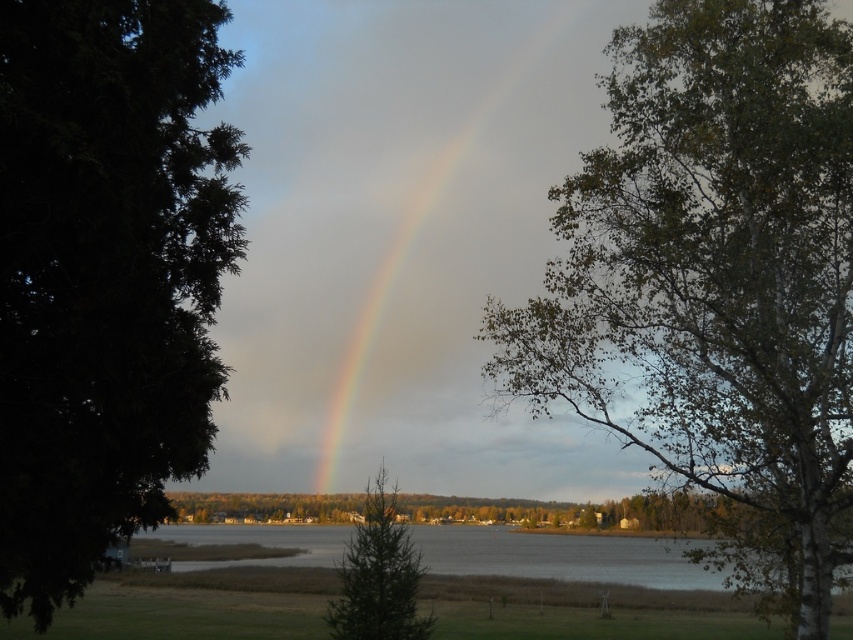
Can you confirm if clear water at lower center is shorter than green matte tree at center?

In fact, clear water at lower center may be taller than green matte tree at center.

Describe the element at coordinates (564, 556) in the screenshot. I see `clear water at lower center` at that location.

You are a GUI agent. You are given a task and a screenshot of the screen. Output one action in this format:
    pyautogui.click(x=<x>, y=<y>)
    Task: Click on the clear water at lower center
    This screenshot has width=853, height=640.
    Given the screenshot: What is the action you would take?
    pyautogui.click(x=564, y=556)

Who is more forward, (849, 554) or (10, 180)?

Point (10, 180)

Is point (782, 248) positioned after point (144, 42)?

That is True.

The image size is (853, 640). I want to click on green leafy tree at right, so click(x=712, y=272).

How distant is rainbow at center from green matte tree at center?

7.49 meters

Is point (497, 99) farther from viewer compared to point (416, 552)?

That is True.

Is point (389, 372) behind point (341, 576)?

Yes, it is behind point (341, 576).

This screenshot has height=640, width=853. Find the location of `rainbow at center`. rainbow at center is located at coordinates (424, 253).